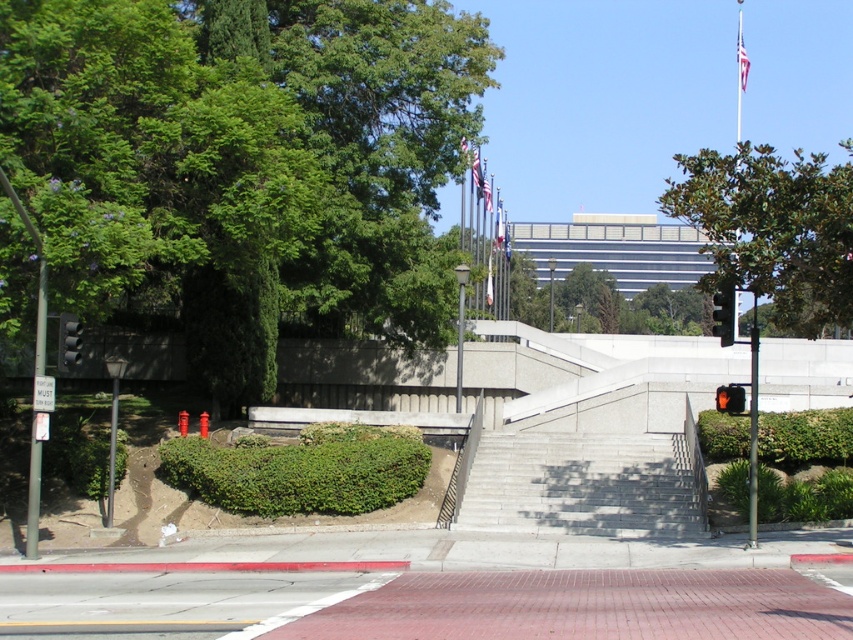
You are a delivery drone flying over an urban area and need to land on the platform with green leafy hedge at center. There is a black plastic traffic light at right nearby. Which object is closer to your current position so you can navigate towards it first?

The green leafy hedge at center is closer to the viewer than the black plastic traffic light at right, so you should navigate towards the green leafy hedge at center first.

You are standing at the base of the stairs leading up to the platform with the green shrubs. You want to take a photo of the green leafy hedge at center using a camera that has a maximum focus range of 60 feet. Will the camera be able to focus on the hedge from your current position?

The green leafy hedge at center and camera are 60.45 feet apart from each other. Since the camera can only focus up to 60 feet, it will not be able to focus on the hedge from your current position as the distance exceeds the maximum focus range.

You are a delivery drone flying over an urban area and need to land on the gray concrete stairs at center. Given that the coordinates of the stairs are known, can you confirm if the stairs are positioned in the central part of the image?

The gray concrete stairs at center are located at coordinates point (x=582, y=484), which indicates they are positioned centrally within the image frame.